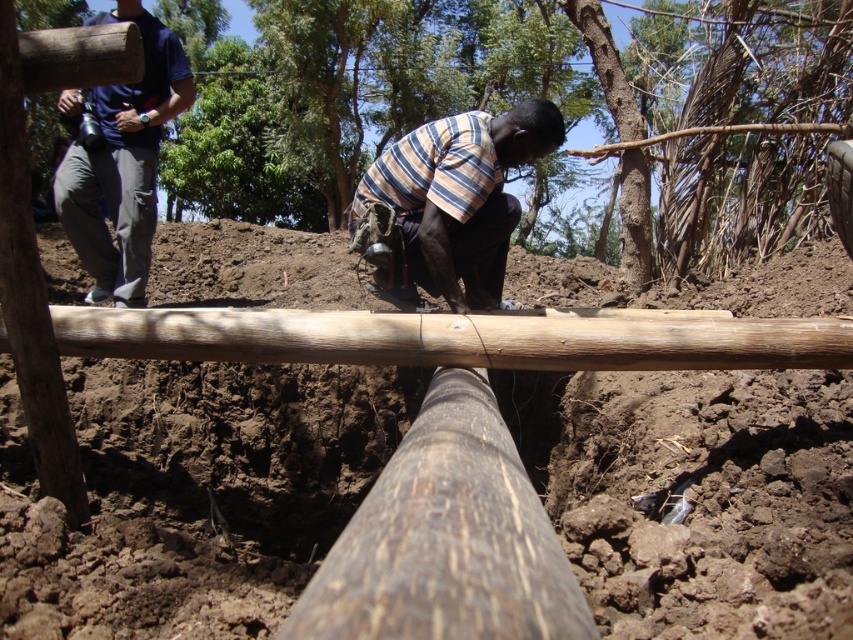
Question: Does striped cotton shirt at center have a lesser width compared to blue cotton shirt at upper left?

Choices:
 (A) no
 (B) yes

Answer: (B)

Question: Considering the relative positions of brown wooden pole at center and striped cotton shirt at center in the image provided, where is brown wooden pole at center located with respect to striped cotton shirt at center?

Choices:
 (A) above
 (B) below

Answer: (A)

Question: Which point is farther from the camera taking this photo?

Choices:
 (A) (137, 189)
 (B) (427, 252)

Answer: (A)

Question: Is brown wooden pole at center positioned at the back of blue cotton shirt at upper left?

Choices:
 (A) yes
 (B) no

Answer: (B)

Question: Which point is closer to the camera taking this photo?

Choices:
 (A) pos(158,145)
 (B) pos(218,64)

Answer: (A)

Question: Considering the real-world distances, which object is closest to the blue cotton shirt at upper left?

Choices:
 (A) brown wooden pole at center
 (B) striped cotton shirt at center

Answer: (B)